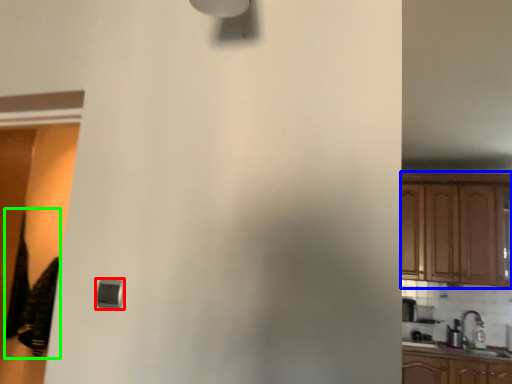
Question: Considering the real-world distances, which object is closest to light (highlighted by a red box)? cabinetry (highlighted by a blue box) or laundry (highlighted by a green box).

Choices:
 (A) cabinetry
 (B) laundry

Answer: (B)